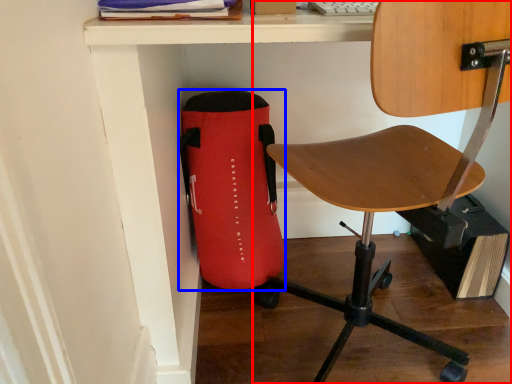
Question: Which point is closer to the camera, chair (highlighted by a red box) or bag (highlighted by a blue box)?

Choices:
 (A) chair
 (B) bag

Answer: (A)